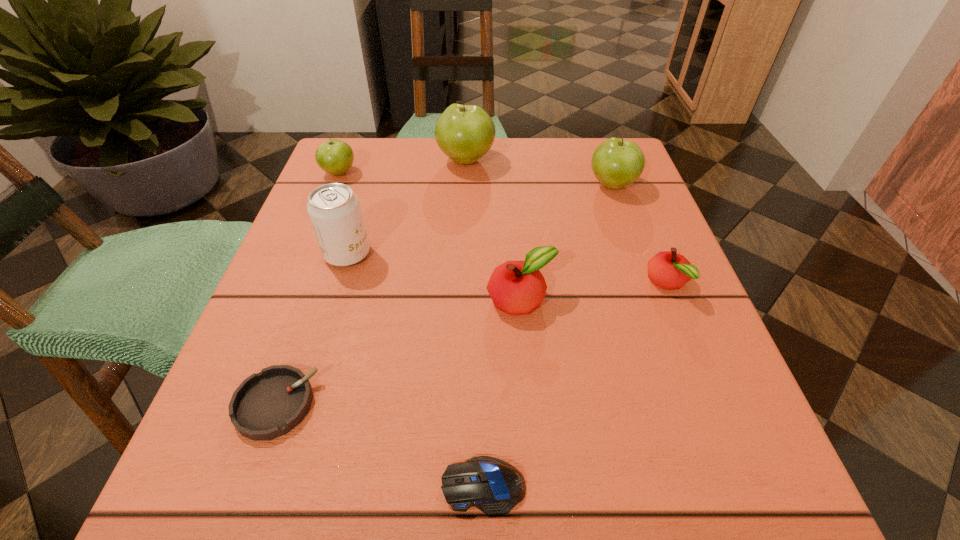
I want to click on ashtray, so click(x=269, y=404).

Identify the location of gray ashtray. (269, 404).

Locate an element on the screen. Image resolution: width=960 pixels, height=540 pixels. computer mouse is located at coordinates (492, 485).

Image resolution: width=960 pixels, height=540 pixels. Identify the location of free spot located on the front of the tallest apple. (464, 222).

Locate an element on the screen. vacant point located 0.160m on the front of the soda can is located at coordinates (320, 346).

At what (x,y) coordinates should I click in order to perform the action: click on blank space located on the left of the second biggest green apple. Please return your answer as a coordinate pair (x, y). This screenshot has height=540, width=960. Looking at the image, I should click on (504, 185).

The height and width of the screenshot is (540, 960). I want to click on free spot located 0.310m on the front of the leftmost apple, so click(x=293, y=288).

Locate an element on the screen. The image size is (960, 540). vacant area situated 0.160m on the left of the bigger red apple is located at coordinates [x=389, y=300].

Where is `vacant space located 0.230m on the front of the right red apple`? The height and width of the screenshot is (540, 960). vacant space located 0.230m on the front of the right red apple is located at coordinates (731, 441).

Identify the location of vacant point located 0.250m on the right of the ashtray. (500, 404).